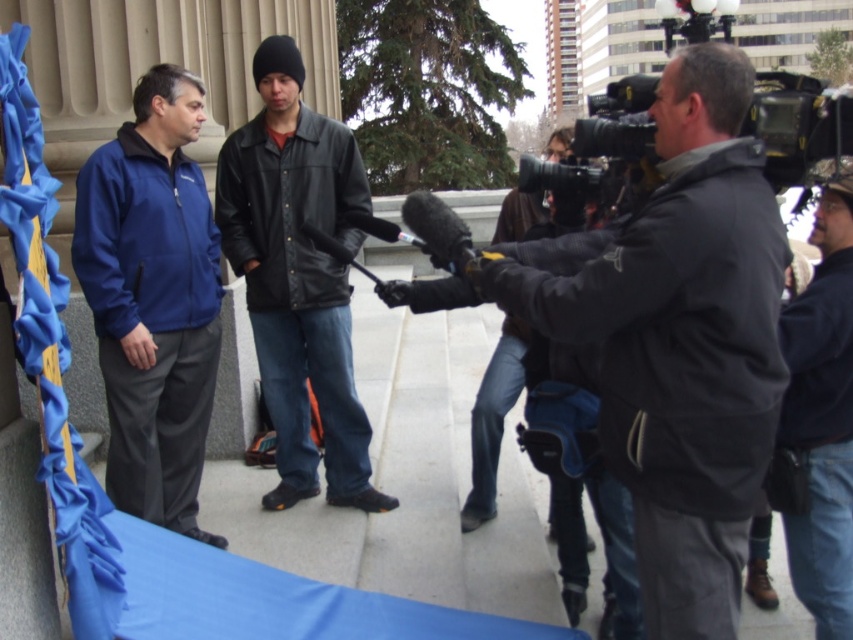
The image size is (853, 640). What are the coordinates of `denim jacket at center` in the screenshot? It's located at (822, 416).

Can you confirm if denim jacket at center is taller than dark gray jacket at right?

Correct, denim jacket at center is much taller as dark gray jacket at right.

Between point (796, 326) and point (497, 438), which one is positioned in front?

Point (796, 326) is more forward.

The width and height of the screenshot is (853, 640). What are the coordinates of `denim jacket at center` in the screenshot? It's located at (822, 416).

Is matte blue jacket at left behind denim jacket at center?

Yes, it is.

Can you confirm if matte blue jacket at left is bigger than denim jacket at center?

Correct, matte blue jacket at left is larger in size than denim jacket at center.

The width and height of the screenshot is (853, 640). Find the location of `matte blue jacket at left`. matte blue jacket at left is located at coordinates (154, 300).

Who is more distant from viewer, (608, 428) or (128, 372)?

Positioned behind is point (128, 372).

At what (x,y) coordinates should I click in order to perform the action: click on dark gray jacket at center. Please return your answer as a coordinate pair (x, y). This screenshot has height=640, width=853. Looking at the image, I should click on (682, 342).

Between point (695, 218) and point (161, 244), which one is positioned in front?

Point (695, 218) is more forward.

Find the location of a particular element. Image resolution: width=853 pixels, height=640 pixels. dark gray jacket at center is located at coordinates (682, 342).